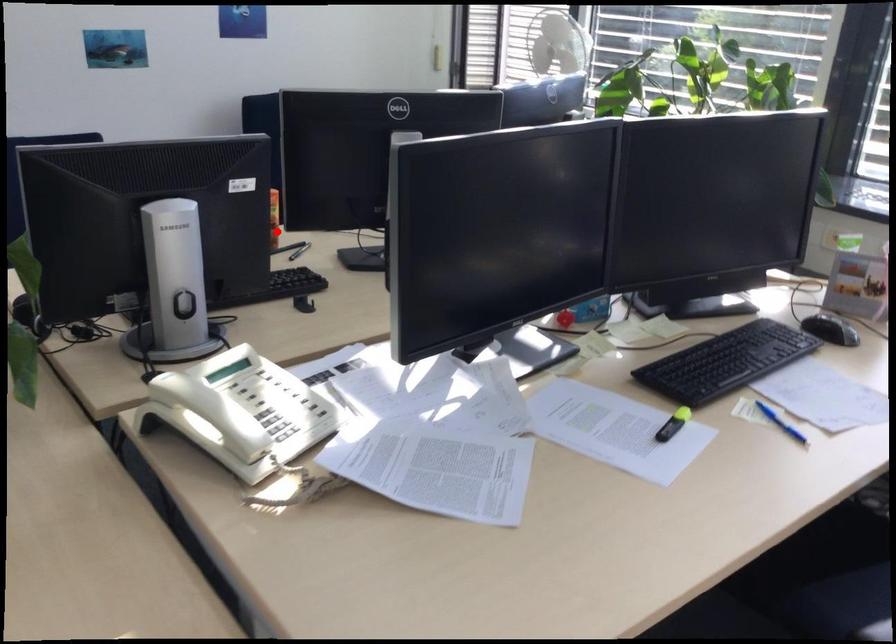
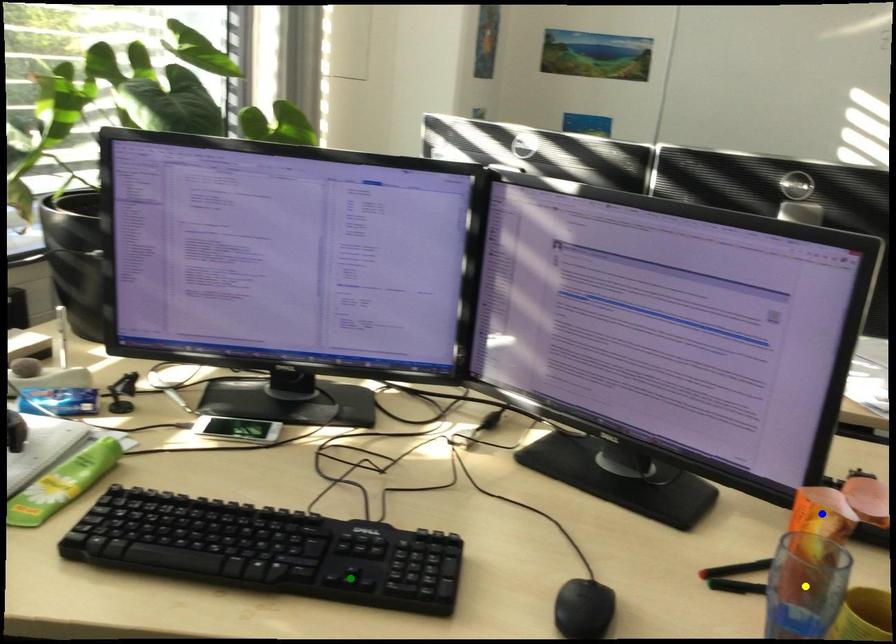
Question: I am providing you with two images of the same scene from different viewpoints. A red point is marked on the first image. You are given multiple points on the second image. Which mark in image 2 goes with the point in image 1?

Choices:
 (A) blue point
 (B) yellow point
 (C) green point

Answer: (B)